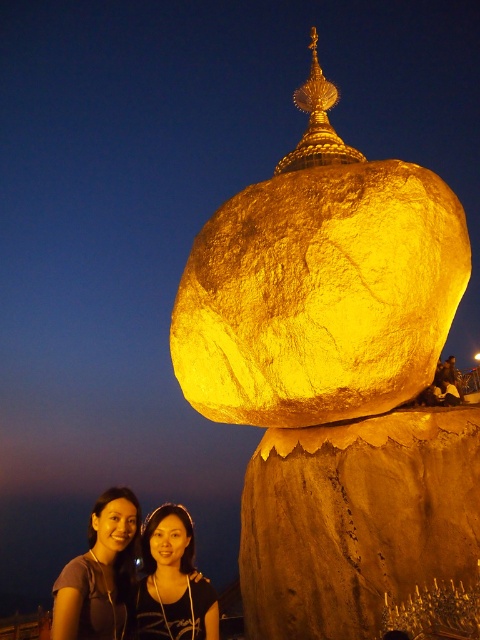
You are a photographer standing at the base of the golden rock formation. You want to take a photo that includes both the matte black hair at lower left and the matte black hair at lower center. What is the minimum distance you need to move backward to ensure both subjects are fully in frame?

The distance between the matte black hair at lower left and the matte black hair at lower center is 5.53 meters. To capture both in the frame, you need to move back until the entire 5.53 meters between them fits within your camera lens field of view. The exact distance depends on your camera and lens specifications, but generally, moving back several meters should allow both subjects to be in frame.

You are standing at the center of the image. Which direction should you move to get closer to the matte black hair at lower left?

To get closer to the matte black hair at lower left, you should move towards the lower left direction since that is where the matte black hair at lower left is positioned.